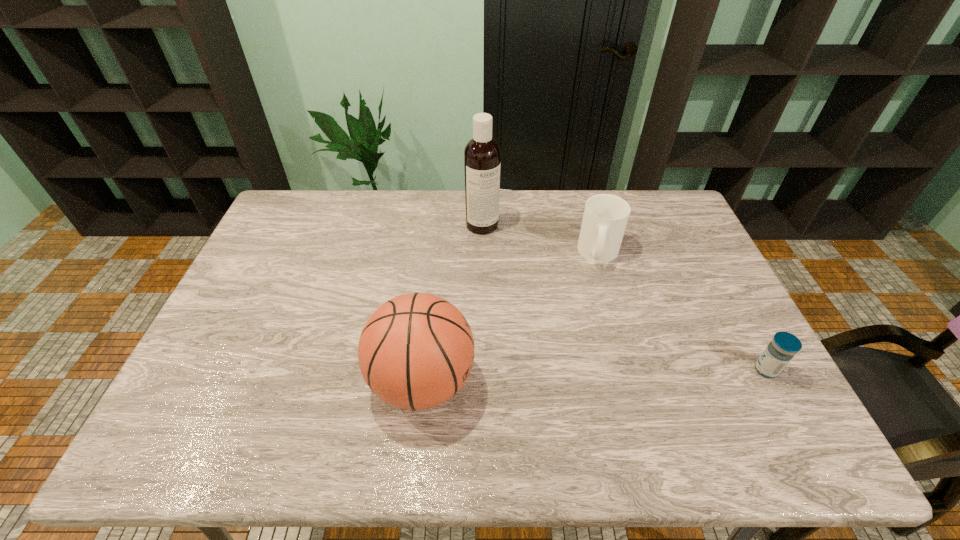
This screenshot has height=540, width=960. I want to click on basketball, so click(416, 351).

This screenshot has height=540, width=960. I want to click on medicine, so point(784,345).

At what (x,y) coordinates should I click in order to perform the action: click on the shortest object. Please return your answer as a coordinate pair (x, y). This screenshot has width=960, height=540. Looking at the image, I should click on (784, 345).

The width and height of the screenshot is (960, 540). Identify the location of mug. (605, 217).

Image resolution: width=960 pixels, height=540 pixels. I want to click on the second object from right to left, so click(605, 217).

Locate an element on the screen. The width and height of the screenshot is (960, 540). the tallest object is located at coordinates (482, 155).

At what (x,y) coordinates should I click in order to perform the action: click on dishwasher detergent. Please return your answer as a coordinate pair (x, y). The width and height of the screenshot is (960, 540). Looking at the image, I should click on (482, 155).

You are a GUI agent. You are given a task and a screenshot of the screen. Output one action in this format:
    pyautogui.click(x=<x>, y=<y>)
    Task: Click on the vacant space located on the surface of the second tallest object near the brand logo
    
    Given the screenshot: What is the action you would take?
    pyautogui.click(x=523, y=382)

Find the location of `free space located 0.310m on the left of the medicine`. free space located 0.310m on the left of the medicine is located at coordinates (633, 370).

The height and width of the screenshot is (540, 960). I want to click on vacant region located 0.140m on the handle side of the mug, so click(x=605, y=306).